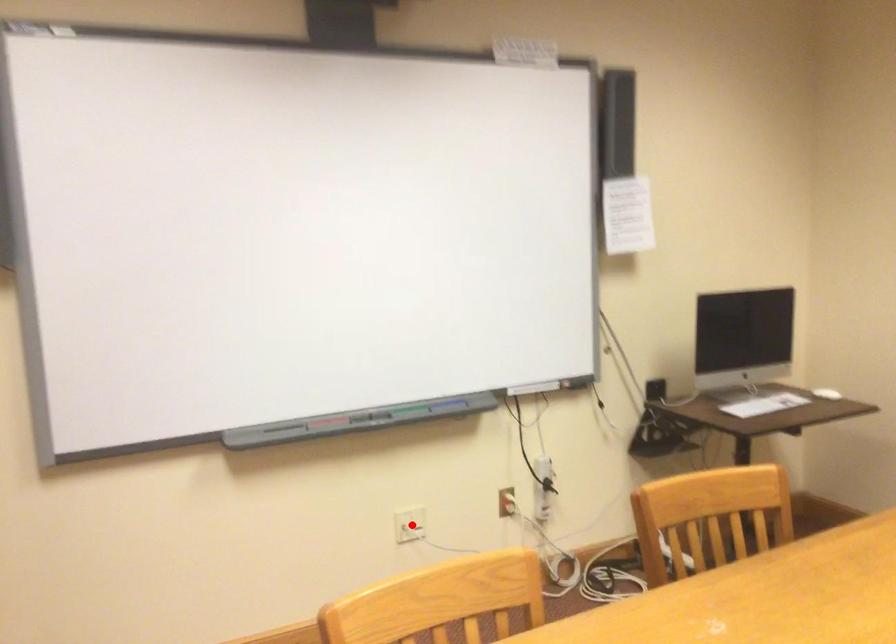
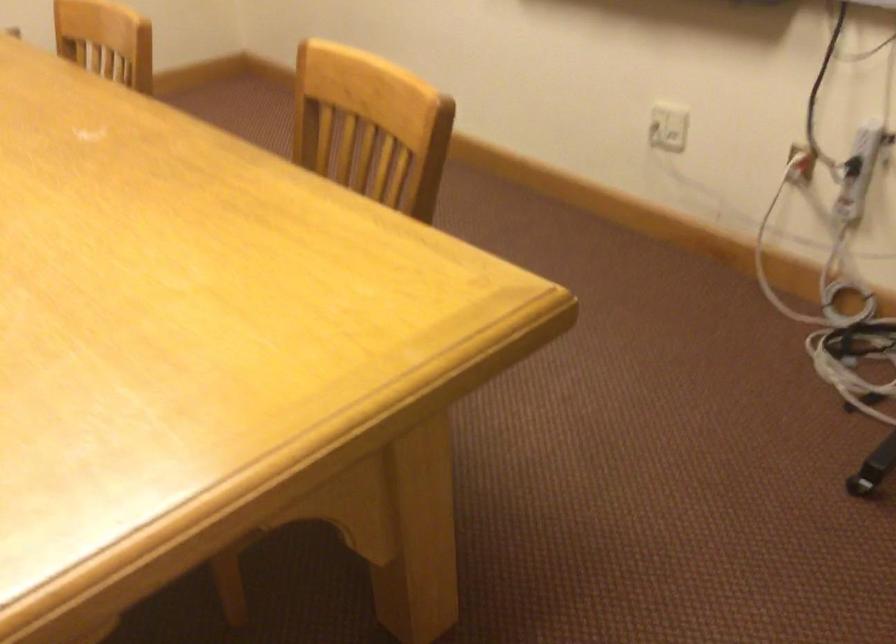
Question: I am providing you with two images of the same scene from different viewpoints. A red point is shown in image1. For the corresponding object point in image2, is it positioned nearer or farther from the camera?

Choices:
 (A) Nearer
 (B) Farther

Answer: (A)